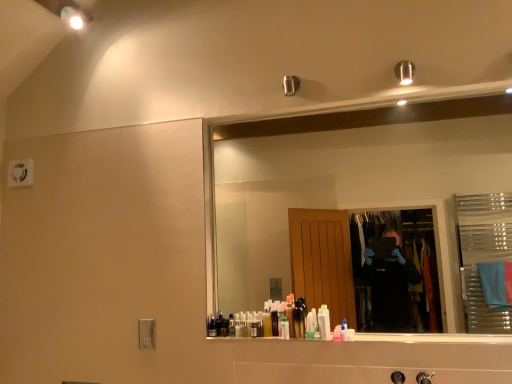
Looking at this image, measure the distance between point (344, 331) and camera.

Point (344, 331) and camera are 8.80 feet apart.

Find the location of a particular element. The width and height of the screenshot is (512, 384). white glossy lotion at center, the 2th toiletry from the right is located at coordinates (325, 314).

What do you see at coordinates (325, 314) in the screenshot?
I see `white glossy lotion at center, which is the fifth toiletry from left to right` at bounding box center [325, 314].

Locate an element on the screen. The width and height of the screenshot is (512, 384). translucent plastic bottle at center, which is the third toiletry from right to left is located at coordinates (310, 326).

Locate an element on the screen. The width and height of the screenshot is (512, 384). pink translucent bottle at center, which is the first toiletry in right-to-left order is located at coordinates (343, 328).

Does white glossy lotion at center, which is the fifth toiletry from left to right, appear on the left side of clear glass mirror at upper center?

Indeed, white glossy lotion at center, which is the fifth toiletry from left to right, is positioned on the left side of clear glass mirror at upper center.

Which is nearer, (329, 323) or (380, 141)?

Point (329, 323) appears to be closer to the viewer than point (380, 141).

Could clear glass mirror at upper center be considered to be inside white glossy lotion at center, the 2th toiletry from the right?

No, clear glass mirror at upper center is not a part of white glossy lotion at center, the 2th toiletry from the right.

Consider the image. Is white glossy lotion at center, which is the fifth toiletry from left to right, turned away from clear glass mirror at upper center?

Yes, white glossy lotion at center, which is the fifth toiletry from left to right, is facing away from clear glass mirror at upper center.

Between brushed metal shower at upper center and translucent plastic tube at center, the second toiletry viewed from the left, which one has less height?

With less height is translucent plastic tube at center, the second toiletry viewed from the left.

Is the position of brushed metal shower at upper center less distant than that of translucent plastic tube at center, the second toiletry viewed from the left?

That is False.

Is brushed metal shower at upper center smaller than translucent plastic tube at center, the fifth toiletry viewed from the right?

No.

Does brushed metal shower at upper center turn towards translucent plastic tube at center, the second toiletry viewed from the left?

No, brushed metal shower at upper center is not facing towards translucent plastic tube at center, the second toiletry viewed from the left.

From the image's perspective, is translucent plastic bottle at center, which is the 6th toiletry from right to left, located above or below translucent plastic tube at center, the fifth toiletry viewed from the right?

translucent plastic bottle at center, which is the 6th toiletry from right to left, is above translucent plastic tube at center, the fifth toiletry viewed from the right.

The image size is (512, 384). What are the coordinates of `the 2nd toiletry below the translucent plastic bottle at center, which is the 6th toiletry from right to left (from the image's perspective)` in the screenshot? It's located at (284, 328).

From the image's perspective, which one is positioned higher, translucent plastic bottle at center, the 4th toiletry when ordered from right to left, or translucent plastic tube at center, the second toiletry viewed from the left?

From the image's view, translucent plastic bottle at center, the 4th toiletry when ordered from right to left, is above.

Considering the relative sizes of translucent plastic bottle at center, which is the third toiletry from left to right, and translucent plastic tube at center, the second toiletry viewed from the left, in the image provided, is translucent plastic bottle at center, which is the third toiletry from left to right, taller than translucent plastic tube at center, the second toiletry viewed from the left,?

Indeed, translucent plastic bottle at center, which is the third toiletry from left to right, has a greater height compared to translucent plastic tube at center, the second toiletry viewed from the left.

From a real-world perspective, is translucent plastic bottle at center, the 4th toiletry when ordered from right to left, physically above translucent plastic tube at center, the fifth toiletry viewed from the right?

Yes, from a real-world perspective, translucent plastic bottle at center, the 4th toiletry when ordered from right to left, is on top of translucent plastic tube at center, the fifth toiletry viewed from the right.

Considering the sizes of objects translucent plastic bottle at center, the 4th toiletry when ordered from right to left, and translucent plastic tube at center, the fifth toiletry viewed from the right, in the image provided, who is smaller, translucent plastic bottle at center, the 4th toiletry when ordered from right to left, or translucent plastic tube at center, the fifth toiletry viewed from the right,?

With smaller size is translucent plastic tube at center, the fifth toiletry viewed from the right.

Based on the photo, how much distance is there between clear glass mirror at upper center and translucent plastic tube at center, the fifth toiletry viewed from the right?

clear glass mirror at upper center is 2.62 meters from translucent plastic tube at center, the fifth toiletry viewed from the right.

Who is smaller, clear glass mirror at upper center or translucent plastic tube at center, the second toiletry viewed from the left?

translucent plastic tube at center, the second toiletry viewed from the left.

From a real-world perspective, count 5th toiletrys downward from the clear glass mirror at upper center and point to it. Please provide its 2D coordinates.

[(284, 328)]

From the image's perspective, relative to translucent plastic bottle at center, which is the third toiletry from right to left, is translucent plastic tube at center, the fifth toiletry viewed from the right, above or below?

translucent plastic tube at center, the fifth toiletry viewed from the right, is situated lower than translucent plastic bottle at center, which is the third toiletry from right to left, in the image.

Is translucent plastic tube at center, the second toiletry viewed from the left, aimed at translucent plastic bottle at center, which is the third toiletry from right to left?

No, translucent plastic tube at center, the second toiletry viewed from the left, is not aimed at translucent plastic bottle at center, which is the third toiletry from right to left.

Is translucent plastic tube at center, the fifth toiletry viewed from the right, shorter than translucent plastic bottle at center, which is the third toiletry from right to left?

Yes.

Would you say translucent plastic tube at center, the fifth toiletry viewed from the right, is to the left or to the right of translucent plastic bottle at center, which is the third toiletry from right to left, in the picture?

translucent plastic tube at center, the fifth toiletry viewed from the right, is positioned on translucent plastic bottle at center, which is the third toiletry from right to left,'s left side.

Based on the photo, which is closer to the camera, (285, 329) or (294, 335)?

Clearly, point (285, 329) is more distant from the camera than point (294, 335).

Which object is further away from the camera, translucent plastic tube at center, the second toiletry viewed from the left, or translucent plastic bottle at center, which is the third toiletry from left to right?

translucent plastic bottle at center, which is the third toiletry from left to right, is further away from the camera.

Could translucent plastic bottle at center, the 4th toiletry when ordered from right to left, be considered to be inside translucent plastic tube at center, the fifth toiletry viewed from the right?

That's incorrect, translucent plastic bottle at center, the 4th toiletry when ordered from right to left, is not inside translucent plastic tube at center, the fifth toiletry viewed from the right.

Locate an element on the screen. This screenshot has width=512, height=384. mirror that appears in front of the white glossy lotion at center, the 2th toiletry from the right is located at coordinates (362, 184).

The width and height of the screenshot is (512, 384). I want to click on shower located above the translucent plastic tube at center, the fifth toiletry viewed from the right (from a real-world perspective), so click(291, 85).

Estimate the real-world distances between objects in this image. Which object is further from translucent plastic bottle at center, the 4th toiletry when ordered from right to left, translucent plastic bottle at center, which is the 6th toiletry from right to left, or translucent plastic bottle at center, which is counted as the 4th toiletry, starting from the left?

The object further to translucent plastic bottle at center, the 4th toiletry when ordered from right to left, is translucent plastic bottle at center, which is the 6th toiletry from right to left.

From the image, which object appears to be nearer to translucent plastic bottle at center, which is the third toiletry from left to right, white glossy lotion at center, which is the fifth toiletry from left to right, or translucent plastic bottle at center, which is the 1th toiletry from left to right?

translucent plastic bottle at center, which is the 1th toiletry from left to right, is closer to translucent plastic bottle at center, which is the third toiletry from left to right.

Which object lies further to the anchor point translucent plastic bottle at center, which is counted as the 4th toiletry, starting from the left, pink translucent bottle at center, the 6th toiletry from the left, or white glossy lotion at center, which is the fifth toiletry from left to right?

Among the two, pink translucent bottle at center, the 6th toiletry from the left, is located further to translucent plastic bottle at center, which is counted as the 4th toiletry, starting from the left.

Estimate the real-world distances between objects in this image. Which object is closer to brushed metal shower at upper center, translucent plastic tube at center, the fifth toiletry viewed from the right, or translucent plastic bottle at center, which is counted as the 4th toiletry, starting from the left?

Among the two, translucent plastic bottle at center, which is counted as the 4th toiletry, starting from the left, is located nearer to brushed metal shower at upper center.

Which object lies nearer to the anchor point translucent plastic bottle at center, the 4th toiletry when ordered from right to left, brushed metal shower at upper center or translucent plastic bottle at center, which is the 6th toiletry from right to left?

translucent plastic bottle at center, which is the 6th toiletry from right to left, lies closer to translucent plastic bottle at center, the 4th toiletry when ordered from right to left, than the other object.

Looking at the image, which one is located closer to pink translucent bottle at center, the 6th toiletry from the left, clear glass mirror at upper center or translucent plastic tube at center, the second toiletry viewed from the left?

Based on the image, translucent plastic tube at center, the second toiletry viewed from the left, appears to be nearer to pink translucent bottle at center, the 6th toiletry from the left.

When comparing their distances from translucent plastic tube at center, the second toiletry viewed from the left, does white glossy lotion at center, the 2th toiletry from the right, or pink translucent bottle at center, the 6th toiletry from the left, seem closer?

white glossy lotion at center, the 2th toiletry from the right, is closer to translucent plastic tube at center, the second toiletry viewed from the left.

Estimate the real-world distances between objects in this image. Which object is further from clear glass mirror at upper center, translucent plastic bottle at center, which is the 6th toiletry from right to left, or pink translucent bottle at center, the 6th toiletry from the left?

Among the two, translucent plastic bottle at center, which is the 6th toiletry from right to left, is located further to clear glass mirror at upper center.

I want to click on toiletry between translucent plastic bottle at center, which is counted as the 4th toiletry, starting from the left, and pink translucent bottle at center, which is the first toiletry in right-to-left order, so click(325, 314).

Where is `mirror between brushed metal shower at upper center and translucent plastic bottle at center, which is counted as the 4th toiletry, starting from the left, vertically`? The image size is (512, 384). mirror between brushed metal shower at upper center and translucent plastic bottle at center, which is counted as the 4th toiletry, starting from the left, vertically is located at coordinates (362, 184).

Locate an element on the screen. toiletry between translucent plastic bottle at center, which is the 6th toiletry from right to left, and translucent plastic bottle at center, which is the third toiletry from left to right, in the horizontal direction is located at coordinates (284, 328).

This screenshot has width=512, height=384. I want to click on toiletry that lies between brushed metal shower at upper center and white glossy lotion at center, the 2th toiletry from the right, from top to bottom, so click(x=298, y=321).